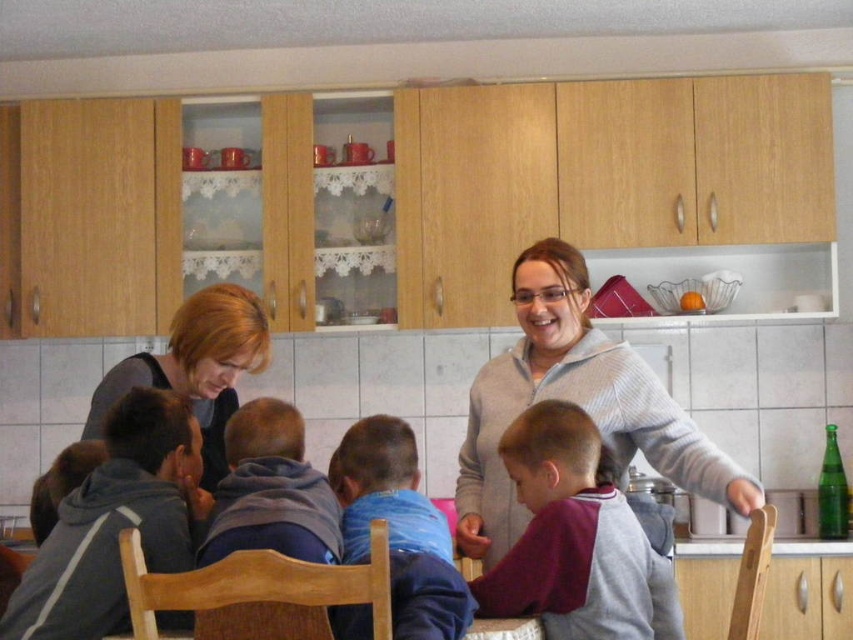
Can you confirm if blue fleece jacket at center is positioned to the right of blonde hair at left?

Yes, blue fleece jacket at center is to the right of blonde hair at left.

Which is below, blue fleece jacket at center or blonde hair at left?

blue fleece jacket at center

What do you see at coordinates (399, 529) in the screenshot? The width and height of the screenshot is (853, 640). I see `blue fleece jacket at center` at bounding box center [399, 529].

At what (x,y) coordinates should I click in order to perform the action: click on blue fleece jacket at center. Please return your answer as a coordinate pair (x, y). Looking at the image, I should click on (399, 529).

How distant is maroon fleece jacket at center from blue fleece jacket at center?

maroon fleece jacket at center and blue fleece jacket at center are 8.36 inches apart.

Which of these two, maroon fleece jacket at center or blue fleece jacket at center, stands shorter?

blue fleece jacket at center

Is point (544, 540) less distant than point (383, 467)?

Yes, point (544, 540) is in front of point (383, 467).

Identify the location of maroon fleece jacket at center. (575, 540).

Does gray striped sweater at upper center appear under maroon fleece jacket at center?

No.

Does gray striped sweater at upper center have a greater height compared to maroon fleece jacket at center?

Yes.

Is point (532, 301) positioned in front of point (596, 544)?

No, (532, 301) is behind (596, 544).

This screenshot has height=640, width=853. Find the location of `gray striped sweater at upper center`. gray striped sweater at upper center is located at coordinates (575, 403).